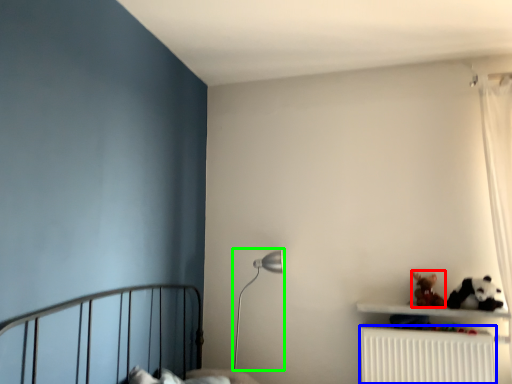
Question: Which object is positioned closest to toy (highlighted by a red box)? Select from radiator (highlighted by a blue box) and table lamp (highlighted by a green box).

Choices:
 (A) radiator
 (B) table lamp

Answer: (A)